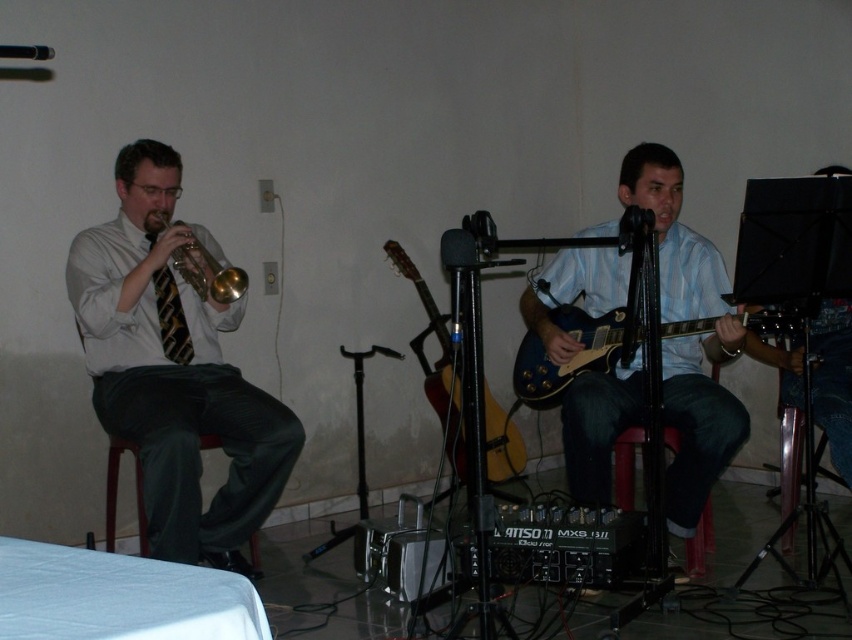
You are a photographer taking a picture of the gold shiny trumpet at left and the striped fabric tie at left. Which object is closer to the camera?

The gold shiny trumpet at left is positioned over the striped fabric tie at left, so it is closer to the camera.

You are standing in the room and want to place a new poster on the wall directly behind the shiny gold trumpet at left. According to the coordinates provided, where should you place the poster?

The shiny gold trumpet at left is located at point (174, 369), so you should place the poster directly behind this coordinate to position it correctly behind the trumpet.